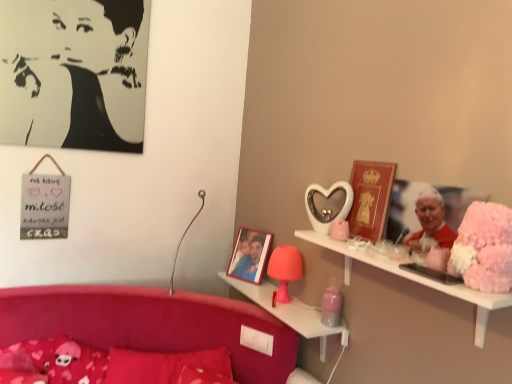
Question: Can we say metallic silver table lamp at center, which is the second table lamp from right to left, lies outside black paper portrait at upper left?

Choices:
 (A) no
 (B) yes

Answer: (B)

Question: Is metallic silver table lamp at center, which is the second table lamp from right to left, turned away from black paper portrait at upper left?

Choices:
 (A) yes
 (B) no

Answer: (B)

Question: Is metallic silver table lamp at center, which is the first table lamp in left-to-right order, wider than black paper portrait at upper left?

Choices:
 (A) yes
 (B) no

Answer: (A)

Question: Is black paper portrait at upper left completely or partially inside metallic silver table lamp at center, which is the second table lamp from right to left?

Choices:
 (A) yes
 (B) no

Answer: (B)

Question: Considering the relative sizes of metallic silver table lamp at center, which is the second table lamp from right to left, and black paper portrait at upper left in the image provided, is metallic silver table lamp at center, which is the second table lamp from right to left, thinner than black paper portrait at upper left?

Choices:
 (A) no
 (B) yes

Answer: (A)

Question: From a real-world perspective, is velvet red pillow at lower left, the 2th pillow viewed from the left, physically located above or below matte pink plastic table lamp at center, which appears as the 2th table lamp when viewed from the left?

Choices:
 (A) below
 (B) above

Answer: (A)

Question: Considering their positions, is velvet red pillow at lower left, the 2th pillow viewed from the left, located in front of or behind matte pink plastic table lamp at center, the first table lamp viewed from the right?

Choices:
 (A) behind
 (B) front

Answer: (B)

Question: Considering the positions of velvet red pillow at lower left, the 2th pillow viewed from the left, and matte pink plastic table lamp at center, the first table lamp viewed from the right, in the image, is velvet red pillow at lower left, the 2th pillow viewed from the left, wider or thinner than matte pink plastic table lamp at center, the first table lamp viewed from the right,?

Choices:
 (A) wide
 (B) thin

Answer: (A)

Question: From the image's perspective, is velvet red pillow at lower left, positioned as the 1th pillow in right-to-left order, above or below matte pink plastic table lamp at center, which appears as the 2th table lamp when viewed from the left?

Choices:
 (A) above
 (B) below

Answer: (B)

Question: Would you say white matte shelf at upper right, acting as the first shelf starting from the top, is inside or outside matte pink lamp at center, the 1th shelf from the bottom?

Choices:
 (A) outside
 (B) inside

Answer: (A)

Question: Based on their positions, is white matte shelf at upper right, arranged as the 1th shelf when viewed from the front, located to the left or right of matte pink lamp at center, arranged as the second shelf when viewed from the top?

Choices:
 (A) right
 (B) left

Answer: (A)

Question: From a real-world perspective, is white matte shelf at upper right, which ranks as the second shelf in bottom-to-top order, above or below matte pink lamp at center, the 1th shelf from the bottom?

Choices:
 (A) below
 (B) above

Answer: (B)

Question: Looking at the image, does white matte shelf at upper right, acting as the first shelf starting from the top, seem bigger or smaller compared to matte pink lamp at center, arranged as the second shelf when viewed from the top?

Choices:
 (A) small
 (B) big

Answer: (B)

Question: Is point (328, 243) closer or farther from the camera than point (27, 89)?

Choices:
 (A) closer
 (B) farther

Answer: (A)

Question: In terms of width, does white matte shelf at upper right, arranged as the 1th shelf when viewed from the front, look wider or thinner when compared to black paper portrait at upper left?

Choices:
 (A) thin
 (B) wide

Answer: (B)